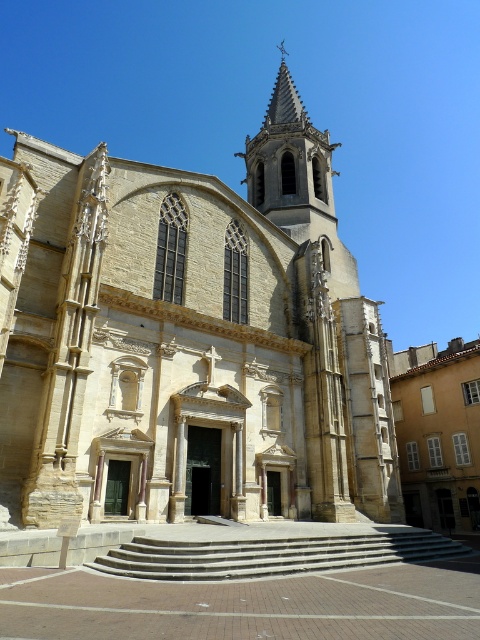
Question: Which object is closer to the camera taking this photo?

Choices:
 (A) beige stone church at center
 (B) gray concrete stairs at center

Answer: (B)

Question: Is beige stone church at center smaller than gray concrete stairs at center?

Choices:
 (A) no
 (B) yes

Answer: (A)

Question: Is beige stone church at center above gray concrete stairs at center?

Choices:
 (A) no
 (B) yes

Answer: (B)

Question: Does beige stone church at center lie in front of gray concrete stairs at center?

Choices:
 (A) no
 (B) yes

Answer: (A)

Question: Among these objects, which one is nearest to the camera?

Choices:
 (A) beige stone church at center
 (B) gray concrete stairs at center

Answer: (B)